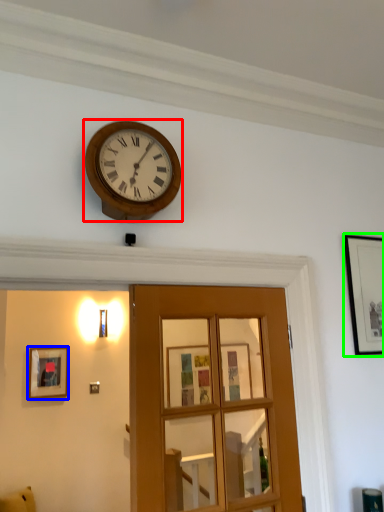
Question: Considering the real-world distances, which object is farthest from wall clock (highlighted by a red box)? picture frame (highlighted by a blue box) or picture frame (highlighted by a green box)?

Choices:
 (A) picture frame
 (B) picture frame

Answer: (A)